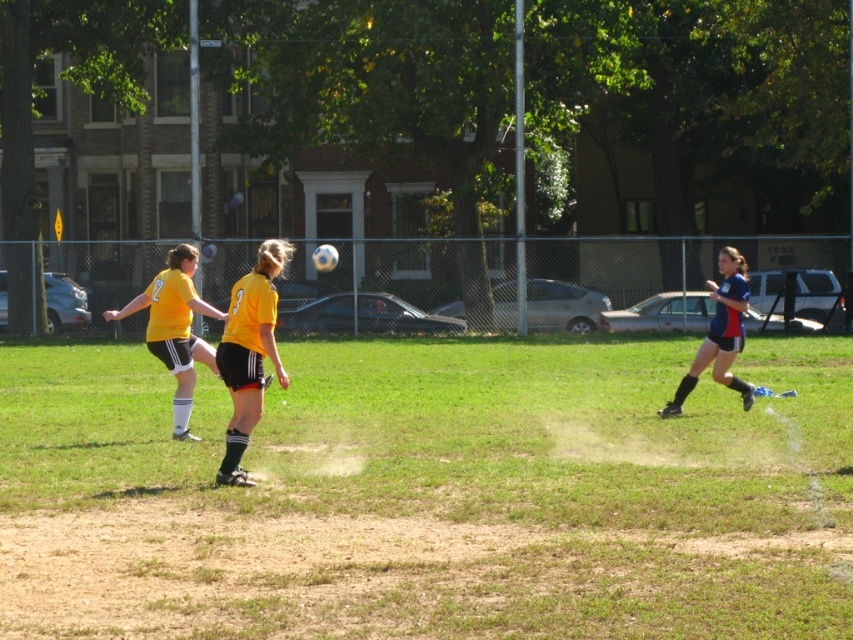
You are a photographer standing at the edge of the soccer field. You want to take a closeup shot of the yellow matte jersey at center. Considering your camera has a maximum zoom range of 10 meters, will you be able to capture the jersey clearly?

The yellow matte jersey at center is 10.58 meters away from the viewer. Since the camera can only zoom up to 10 meters, it won not be able to capture the jersey clearly.